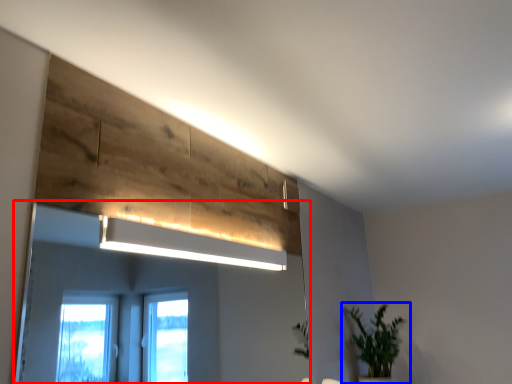
Question: Which of the following is the closest to the observer, mirror (highlighted by a red box) or houseplant (highlighted by a blue box)?

Choices:
 (A) mirror
 (B) houseplant

Answer: (A)